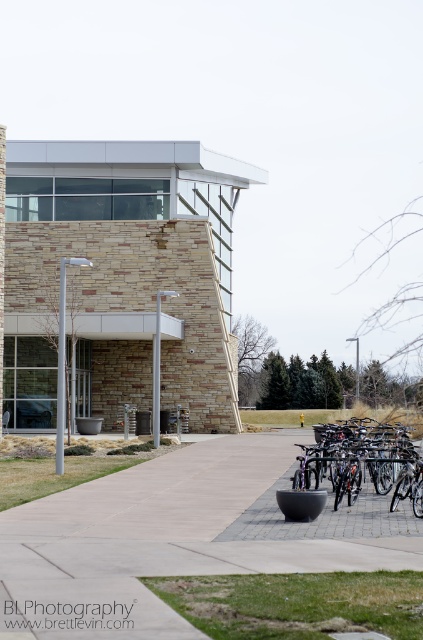
In the scene shown: You are a delivery person with a cart that is 1.2 meters wide. You need to navigate through the gray concrete pavement at center to reach the entrance. Can your cart fit through the space between the shiny metallic bicycles at lower right?

The gray concrete pavement at center is wider than the shiny metallic bicycles at lower right, so the cart that is 1.2 meters wide can fit through the space between the shiny metallic bicycles at lower right.

You are standing at the entrance of the modern building and want to walk to the gray concrete pavement at center. Based on the 2D coordinates provided, in which direction should you move relative to your current position?

The gray concrete pavement at center is located at point 0.845 on the x axis and 0.407 on the y axis. Since you are at the entrance, which is likely near the lower part of the image, moving towards the center would mean moving upwards along the y axis to 0.407 and slightly to the right along the x axis to 0.845.